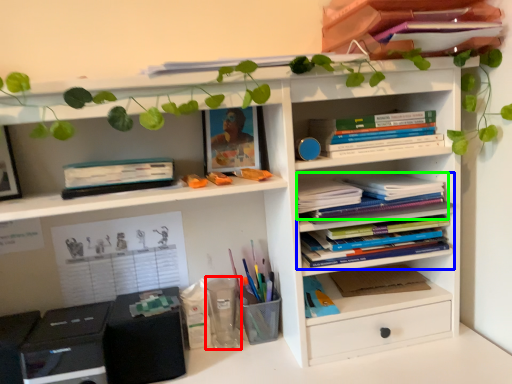
Question: Which is nearer to the stationery (highlighted by a red box)? book (highlighted by a blue box) or book (highlighted by a green box).

Choices:
 (A) book
 (B) book

Answer: (A)